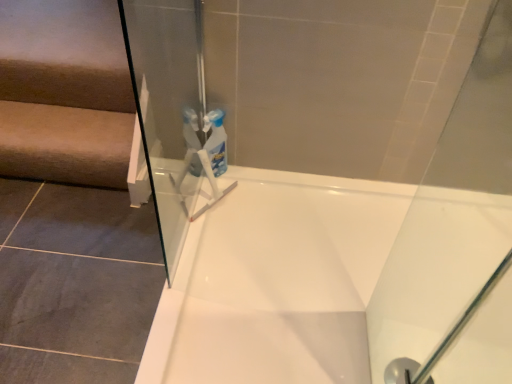
Describe the element at coordinates (401, 371) in the screenshot. This screenshot has width=512, height=384. I see `transparent glass shower at lower right` at that location.

You are a GUI agent. You are given a task and a screenshot of the screen. Output one action in this format:
    pyautogui.click(x=<x>, y=<y>)
    Task: Click on the beige fabric stairwell at left
    This screenshot has height=384, width=512.
    Given the screenshot: What is the action you would take?
    pyautogui.click(x=65, y=123)

From the image's perspective, would you say beige fabric stairwell at left is shown under white glossy bathtub at center?

Actually, beige fabric stairwell at left appears above white glossy bathtub at center in the image.

Can you confirm if beige fabric stairwell at left is smaller than white glossy bathtub at center?

Correct, beige fabric stairwell at left occupies less space than white glossy bathtub at center.

From a real-world perspective, does beige fabric stairwell at left stand above white glossy bathtub at center?

Indeed, from a real-world perspective, beige fabric stairwell at left stands above white glossy bathtub at center.

Considering the sizes of beige fabric stairwell at left and transparent glass shower at lower right in the image, is beige fabric stairwell at left wider or thinner than transparent glass shower at lower right?

beige fabric stairwell at left is wider than transparent glass shower at lower right.

Could you tell me if beige fabric stairwell at left is facing transparent glass shower at lower right?

No, beige fabric stairwell at left is not turned towards transparent glass shower at lower right.

Is point (4, 98) positioned behind point (399, 378)?

Yes, point (4, 98) is behind point (399, 378).

Consider the image. From a real-world perspective, is beige fabric stairwell at left over transparent glass shower at lower right?

Indeed, from a real-world perspective, beige fabric stairwell at left stands above transparent glass shower at lower right.

Looking at this image, can you tell me how much white glossy bathtub at center and transparent glass shower at lower right differ in facing direction?

They differ by 1.78 degrees in their facing directions.

Is white glossy bathtub at center looking in the opposite direction of transparent glass shower at lower right?

That's right, white glossy bathtub at center is facing away from transparent glass shower at lower right.

Considering the relative sizes of white glossy bathtub at center and transparent glass shower at lower right in the image provided, is white glossy bathtub at center shorter than transparent glass shower at lower right?

In fact, white glossy bathtub at center may be taller than transparent glass shower at lower right.

From a real-world perspective, who is located higher, white glossy bathtub at center or transparent glass shower at lower right?

white glossy bathtub at center is physically above.

How different are the orientations of white glossy bathtub at center and beige fabric stairwell at left in degrees?

There is a 0.876-degree angle between the facing directions of white glossy bathtub at center and beige fabric stairwell at left.

Are white glossy bathtub at center and beige fabric stairwell at left beside each other?

No, white glossy bathtub at center is not in contact with beige fabric stairwell at left.

Is white glossy bathtub at center facing away from beige fabric stairwell at left?

No, white glossy bathtub at center's orientation is not away from beige fabric stairwell at left.

Is white glossy bathtub at center wider or thinner than beige fabric stairwell at left?

Clearly, white glossy bathtub at center has more width compared to beige fabric stairwell at left.

From a real-world perspective, does transparent glass shower at lower right sit lower than beige fabric stairwell at left?

Yes, from a real-world perspective, transparent glass shower at lower right is below beige fabric stairwell at left.

Can you tell me how much transparent glass shower at lower right and beige fabric stairwell at left differ in facing direction?

0.906 degrees.

Looking at this image, from the image's perspective, which one is positioned lower, transparent glass shower at lower right or beige fabric stairwell at left?

transparent glass shower at lower right is shown below in the image.

How much distance is there between transparent glass shower at lower right and beige fabric stairwell at left?

transparent glass shower at lower right is 4.22 feet from beige fabric stairwell at left.

Which is in front, point (404, 359) or point (193, 287)?

The point (404, 359) is in front.

Between transparent glass shower at lower right and white glossy bathtub at center, which one has less height?

With less height is transparent glass shower at lower right.

From the picture: Considering the relative sizes of transparent glass shower at lower right and white glossy bathtub at center in the image provided, is transparent glass shower at lower right bigger than white glossy bathtub at center?

No, transparent glass shower at lower right is not bigger than white glossy bathtub at center.

Is transparent glass shower at lower right far away from white glossy bathtub at center?

No, transparent glass shower at lower right is not far from white glossy bathtub at center.

Where is `bathtub below the beige fabric stairwell at left (from the image's perspective)`? This screenshot has width=512, height=384. bathtub below the beige fabric stairwell at left (from the image's perspective) is located at coordinates (320, 279).

Where is `stairwell above the transparent glass shower at lower right (from the image's perspective)`? The height and width of the screenshot is (384, 512). stairwell above the transparent glass shower at lower right (from the image's perspective) is located at coordinates (65, 123).

When comparing their distances from transparent glass shower at lower right, does beige fabric stairwell at left or white glossy bathtub at center seem closer?

white glossy bathtub at center is closer to transparent glass shower at lower right.

Estimate the real-world distances between objects in this image. Which object is closer to white glossy bathtub at center, transparent glass shower at lower right or beige fabric stairwell at left?

transparent glass shower at lower right is positioned closer to the anchor white glossy bathtub at center.

Estimate the real-world distances between objects in this image. Which object is closer to transparent glass shower at lower right, white glossy bathtub at center or beige fabric stairwell at left?

The object closer to transparent glass shower at lower right is white glossy bathtub at center.

From the image, which object appears to be nearer to beige fabric stairwell at left, transparent glass shower at lower right or white glossy bathtub at center?

white glossy bathtub at center.

Estimate the real-world distances between objects in this image. Which object is further from beige fabric stairwell at left, white glossy bathtub at center or transparent glass shower at lower right?

transparent glass shower at lower right is further to beige fabric stairwell at left.

Which object lies nearer to the anchor point white glossy bathtub at center, beige fabric stairwell at left or transparent glass shower at lower right?

The object closer to white glossy bathtub at center is transparent glass shower at lower right.

Find the location of a particular element. This screenshot has height=384, width=512. bathtub between beige fabric stairwell at left and transparent glass shower at lower right is located at coordinates (320, 279).